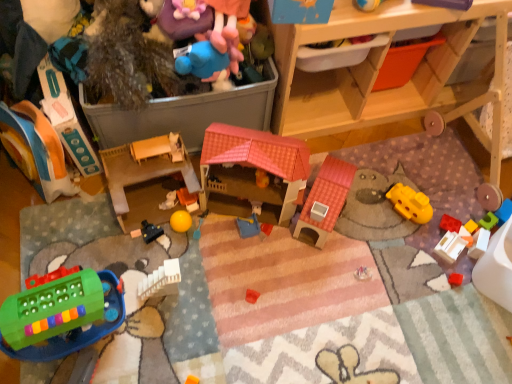
This screenshot has width=512, height=384. What are the coordinates of `free point in front of wooden dollhouse at center-left, the tenth toy viewed from the right` in the screenshot? It's located at (139, 254).